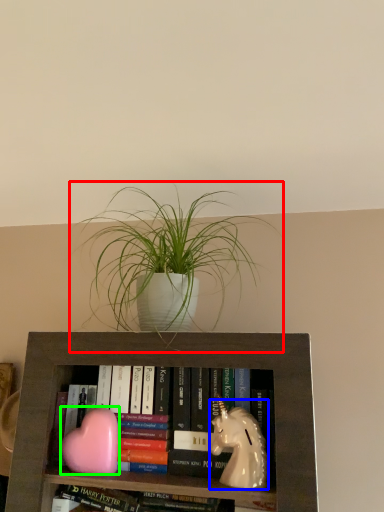
Question: Which object is positioned closest to houseplant (highlighted by a red box)? Select from animal (highlighted by a blue box) and animal (highlighted by a green box).

Choices:
 (A) animal
 (B) animal

Answer: (A)